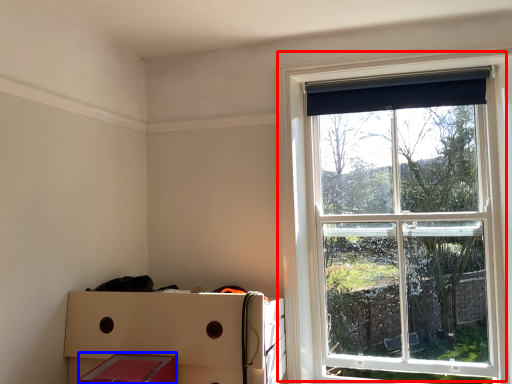
Question: Which point is closer to the camera, window (highlighted by a red box) or storage box (highlighted by a blue box)?

Choices:
 (A) window
 (B) storage box

Answer: (B)